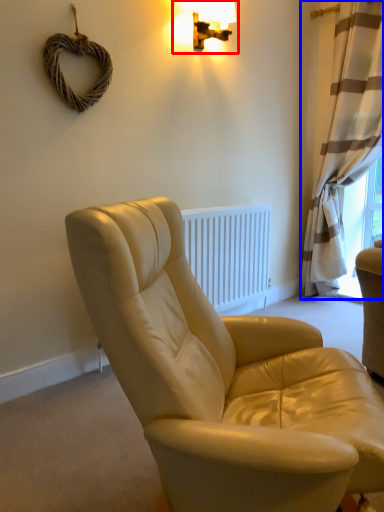
Question: Among these objects, which one is farthest to the camera, lamp (highlighted by a red box) or curtain (highlighted by a blue box)?

Choices:
 (A) lamp
 (B) curtain

Answer: (B)